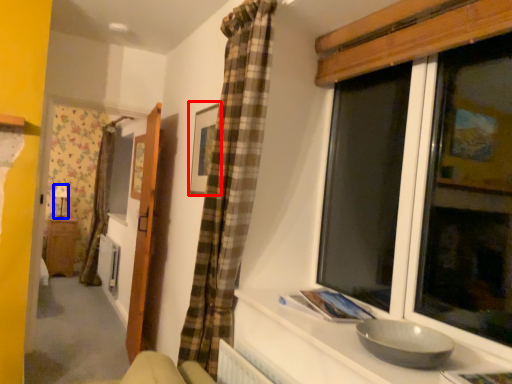
Question: Which point is closer to the camera, picture frame (highlighted by a red box) or lamp (highlighted by a blue box)?

Choices:
 (A) picture frame
 (B) lamp

Answer: (A)